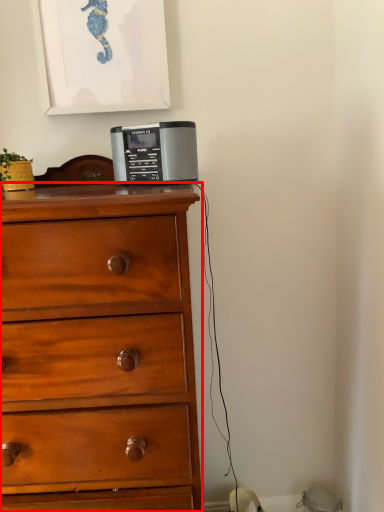
Question: From the image's perspective, considering the relative positions of chest of drawers (annotated by the red box) and home appliance in the image provided, where is chest of drawers (annotated by the red box) located with respect to the staircase?

Choices:
 (A) below
 (B) above

Answer: (A)